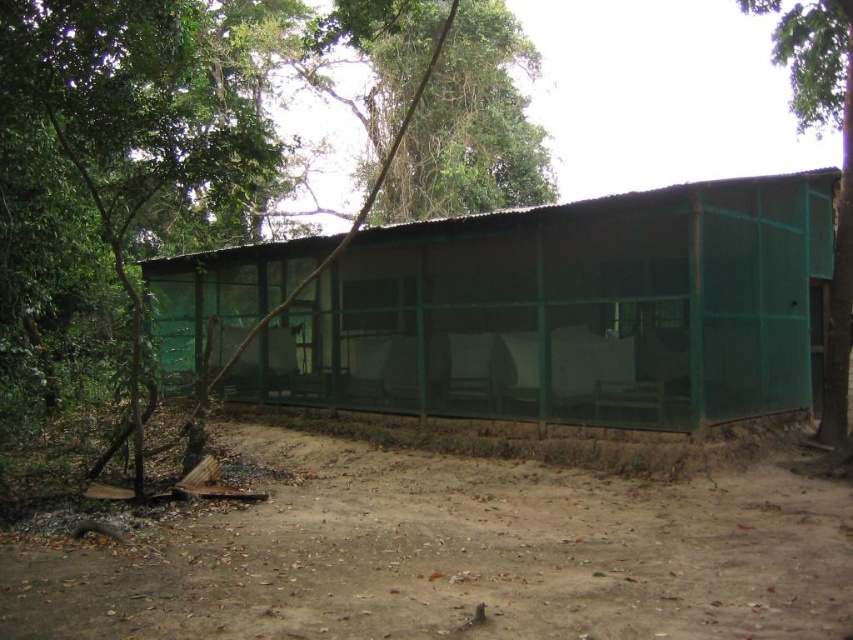
Does brown dirt track at lower center appear on the left side of green mesh screen at center?

No, brown dirt track at lower center is not to the left of green mesh screen at center.

From the picture: Between brown dirt track at lower center and green mesh screen at center, which one appears on the left side from the viewer's perspective?

green mesh screen at center

You are a GUI agent. You are given a task and a screenshot of the screen. Output one action in this format:
    pyautogui.click(x=<x>, y=<y>)
    Task: Click on the brown dirt track at lower center
    The width and height of the screenshot is (853, 640).
    Given the screenshot: What is the action you would take?
    pyautogui.click(x=456, y=556)

The height and width of the screenshot is (640, 853). Identify the location of brown dirt track at lower center. (456, 556).

Which of these two, brown dirt track at lower center or green mesh fence at right, stands shorter?

brown dirt track at lower center

Does brown dirt track at lower center have a greater height compared to green mesh fence at right?

In fact, brown dirt track at lower center may be shorter than green mesh fence at right.

Measure the distance between brown dirt track at lower center and camera.

A distance of 4.59 meters exists between brown dirt track at lower center and camera.

The image size is (853, 640). What are the coordinates of `brown dirt track at lower center` in the screenshot? It's located at (456, 556).

Does brown dirt track at lower center appear on the right side of green mesh hut at center?

No, brown dirt track at lower center is not to the right of green mesh hut at center.

Is brown dirt track at lower center above green mesh hut at center?

Incorrect, brown dirt track at lower center is not positioned above green mesh hut at center.

Describe the element at coordinates (456, 556) in the screenshot. The image size is (853, 640). I see `brown dirt track at lower center` at that location.

Locate an element on the screen. brown dirt track at lower center is located at coordinates (456, 556).